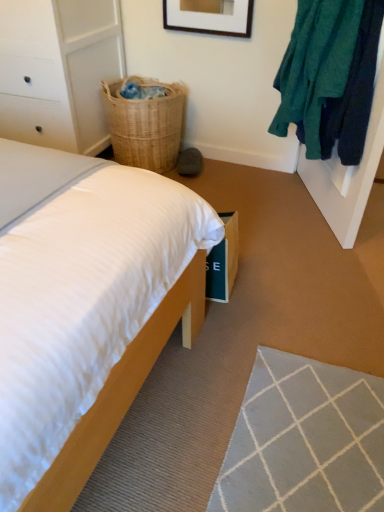
At what (x,y) coordinates should I click in order to perform the action: click on teal fuzzy sweater at upper right. Please return your answer as a coordinate pair (x, y). This screenshot has width=384, height=512. Looking at the image, I should click on (329, 76).

What is the approximate width of white painted wood dresser at left?

The width of white painted wood dresser at left is 25.48 inches.

Measure the distance between wooden bed at lower left and camera.

23.96 inches.

The width and height of the screenshot is (384, 512). In order to click on teal fuzzy sweater at upper right in this screenshot , I will do `click(329, 76)`.

At what (x,y) coordinates should I click in order to perform the action: click on clothing behind the wooden bed at lower left. Please return your answer as a coordinate pair (x, y). Looking at the image, I should click on (329, 76).

Can we say wooden bed at lower left lies outside teal fuzzy sweater at upper right?

wooden bed at lower left is positioned outside teal fuzzy sweater at upper right.

Is wooden bed at lower left not near teal fuzzy sweater at upper right?

Yes, wooden bed at lower left and teal fuzzy sweater at upper right are quite far apart.

Considering the positions of objects wooden bed at lower left and white painted wood dresser at left in the image provided, who is more to the right, wooden bed at lower left or white painted wood dresser at left?

wooden bed at lower left.

Who is taller, wooden bed at lower left or white painted wood dresser at left?

white painted wood dresser at left is taller.

Considering the points (78, 226) and (80, 125), which point is behind, point (78, 226) or point (80, 125)?

The point (80, 125) is farther.

Measure the distance from wooden bed at lower left to white painted wood dresser at left.

wooden bed at lower left is 4.19 feet from white painted wood dresser at left.

From a real-world perspective, relative to teal fuzzy sweater at upper right, is white painted wood dresser at left vertically above or below?

From a real-world perspective, white painted wood dresser at left is physically below teal fuzzy sweater at upper right.

Is point (108, 35) closer to camera compared to point (304, 129)?

No.

Can you confirm if woven natural basket at upper right is wider than wooden bed at lower left?

Incorrect, the width of woven natural basket at upper right does not surpass that of wooden bed at lower left.

Find the location of a particular element. This screenshot has width=384, height=512. bed that appears on the right of woven natural basket at upper right is located at coordinates (78, 288).

Does point (149, 115) appear closer or farther from the camera than point (52, 436)?

Point (149, 115).

In the scene shown: Considering the positions of objects woven natural basket at upper right and wooden bed at lower left in the image provided, who is behind, woven natural basket at upper right or wooden bed at lower left?

woven natural basket at upper right.

From a real-world perspective, is white painted wood dresser at left on wooden bed at lower left?

Indeed, from a real-world perspective, white painted wood dresser at left stands above wooden bed at lower left.

Is wooden bed at lower left located within white painted wood dresser at left?

No, wooden bed at lower left is not surrounded by white painted wood dresser at left.

Considering the positions of point (93, 69) and point (171, 286), is point (93, 69) closer or farther from the camera than point (171, 286)?

Clearly, point (93, 69) is more distant from the camera than point (171, 286).

Which object is closer to the camera taking this photo, white painted wood dresser at left or wooden bed at lower left?

wooden bed at lower left.

From the image's perspective, relative to woven natural basket at upper right, is white painted wood dresser at left above or below?

white painted wood dresser at left is above woven natural basket at upper right.

This screenshot has height=512, width=384. Find the location of `dresser above the woven natural basket at upper right (from the image's perspective)`. dresser above the woven natural basket at upper right (from the image's perspective) is located at coordinates (58, 70).

Can you tell me how much white painted wood dresser at left and woven natural basket at upper right differ in facing direction?

white painted wood dresser at left and woven natural basket at upper right are facing 0.286 degrees away from each other.

Consider the image. Looking at their sizes, would you say woven natural basket at upper right is wider or thinner than teal fuzzy sweater at upper right?

In the image, woven natural basket at upper right appears to be wider than teal fuzzy sweater at upper right.

Consider the image. Is woven natural basket at upper right aimed at teal fuzzy sweater at upper right?

No, woven natural basket at upper right is not aimed at teal fuzzy sweater at upper right.

Are woven natural basket at upper right and teal fuzzy sweater at upper right making contact?

No.

Locate an element on the screen. This screenshot has height=512, width=384. clothing in front of the woven natural basket at upper right is located at coordinates (329, 76).

The image size is (384, 512). In the image, there is a teal fuzzy sweater at upper right. Identify the location of bed below it (from a real-world perspective). (78, 288).

You are a GUI agent. You are given a task and a screenshot of the screen. Output one action in this format:
    pyautogui.click(x=<x>, y=<y>)
    Task: Click on the bed located in front of the white painted wood dresser at left
    
    Given the screenshot: What is the action you would take?
    pyautogui.click(x=78, y=288)

Considering their positions, is wooden bed at lower left positioned closer to teal fuzzy sweater at upper right than woven natural basket at upper right?

woven natural basket at upper right is positioned closer to the anchor teal fuzzy sweater at upper right.

Looking at the image, which one is located further to woven natural basket at upper right, teal fuzzy sweater at upper right or wooden bed at lower left?

wooden bed at lower left is further to woven natural basket at upper right.

From the image, which object appears to be nearer to woven natural basket at upper right, wooden bed at lower left or white painted wood dresser at left?

white painted wood dresser at left is positioned closer to the anchor woven natural basket at upper right.

Estimate the real-world distances between objects in this image. Which object is closer to woven natural basket at upper right, wooden bed at lower left or teal fuzzy sweater at upper right?

The object closer to woven natural basket at upper right is teal fuzzy sweater at upper right.

When comparing their distances from wooden bed at lower left, does woven natural basket at upper right or teal fuzzy sweater at upper right seem further?

Based on the image, woven natural basket at upper right appears to be further to wooden bed at lower left.

Estimate the real-world distances between objects in this image. Which object is further from teal fuzzy sweater at upper right, wooden bed at lower left or white painted wood dresser at left?

white painted wood dresser at left is further to teal fuzzy sweater at upper right.

Which object lies further to the anchor point teal fuzzy sweater at upper right, white painted wood dresser at left or woven natural basket at upper right?

Based on the image, white painted wood dresser at left appears to be further to teal fuzzy sweater at upper right.

Looking at the image, which one is located further to wooden bed at lower left, teal fuzzy sweater at upper right or white painted wood dresser at left?

white painted wood dresser at left lies further to wooden bed at lower left than the other object.

Locate an element on the screen. The height and width of the screenshot is (512, 384). basket between white painted wood dresser at left and teal fuzzy sweater at upper right from left to right is located at coordinates (145, 124).

Where is `clothing between wooden bed at lower left and woven natural basket at upper right along the z-axis`? The image size is (384, 512). clothing between wooden bed at lower left and woven natural basket at upper right along the z-axis is located at coordinates (329, 76).

Locate an element on the screen. The image size is (384, 512). dresser between wooden bed at lower left and woven natural basket at upper right from front to back is located at coordinates point(58,70).

Where is `bed between white painted wood dresser at left and teal fuzzy sweater at upper right`? Image resolution: width=384 pixels, height=512 pixels. bed between white painted wood dresser at left and teal fuzzy sweater at upper right is located at coordinates (78, 288).